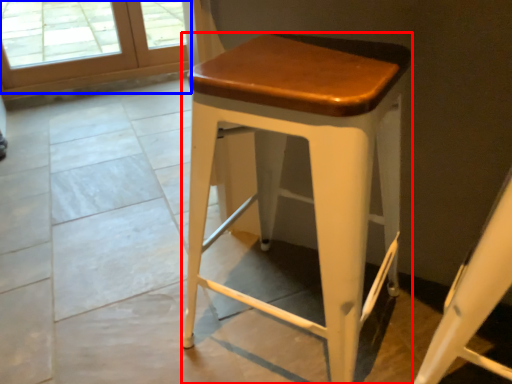
Question: Which of the following is the farthest to the observer, stool (highlighted by a red box) or screen door (highlighted by a blue box)?

Choices:
 (A) stool
 (B) screen door

Answer: (B)